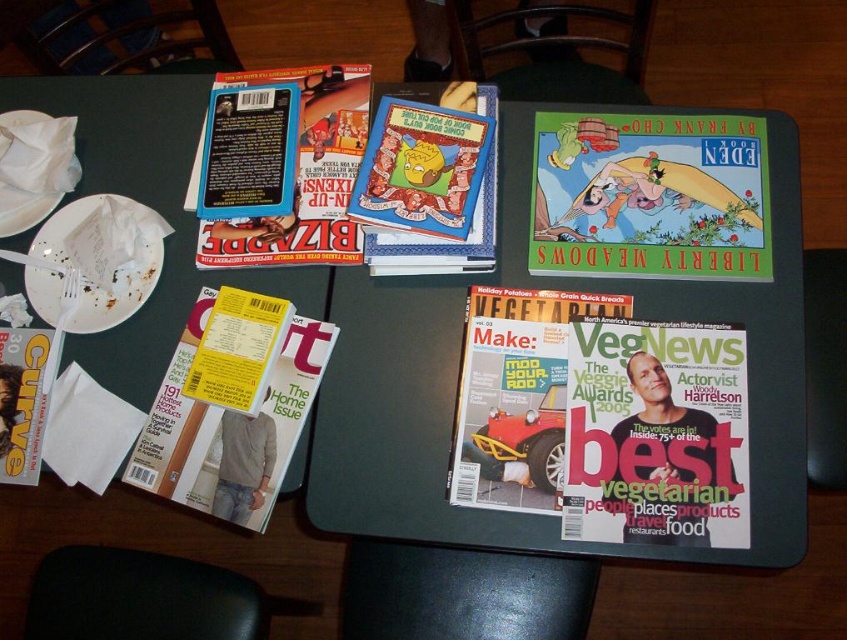
You are organizing a display at a bookstore and need to place the matte black magazine at center and the matte paper magazine at center side by side on a shelf. Given their widths, which magazine should be placed first to ensure they fit properly?

The matte black magazine at center has a lesser width compared to the matte paper magazine at center, so it should be placed first to accommodate the wider matte paper magazine at center next to it.

You are a customer at the cafe and want to know if the hardcover comic book at center can fit in your bag which has a height limit of 10 cm. The matte paper magazine at center is 12 cm tall. Can the comic book fit?

The hardcover comic book at center is not as tall as the matte paper magazine at center, which is 12 cm tall. Since the comic book is shorter, it can fit in your bag with a 10 cm height limit.

You are a person with a height of 5 feet 8 inches. You are standing in front of the table and want to pick up the matte black magazine at center. Can you comfortably reach it without needing to stretch too far?

The matte black magazine at center is 32.41 inches away from the viewer. Since the average comfortable reaching distance for someone 5 feet 8 inches tall is about 28 to 30 inches, the magazine is slightly out of comfortable reach and may require a small stretch.